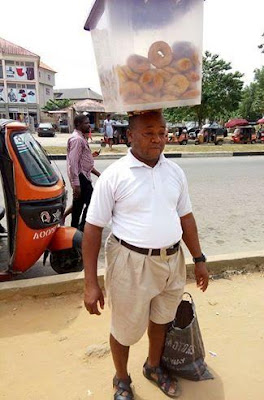
In order to click on plastic storage bin in this screenshot , I will do `click(151, 38)`.